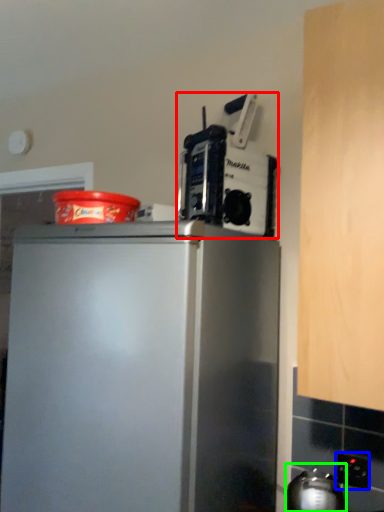
Question: Considering the real-world distances, which object is closest to kitchen appliance (highlighted by a red box)? electric outlet (highlighted by a blue box) or appliance (highlighted by a green box).

Choices:
 (A) electric outlet
 (B) appliance

Answer: (B)